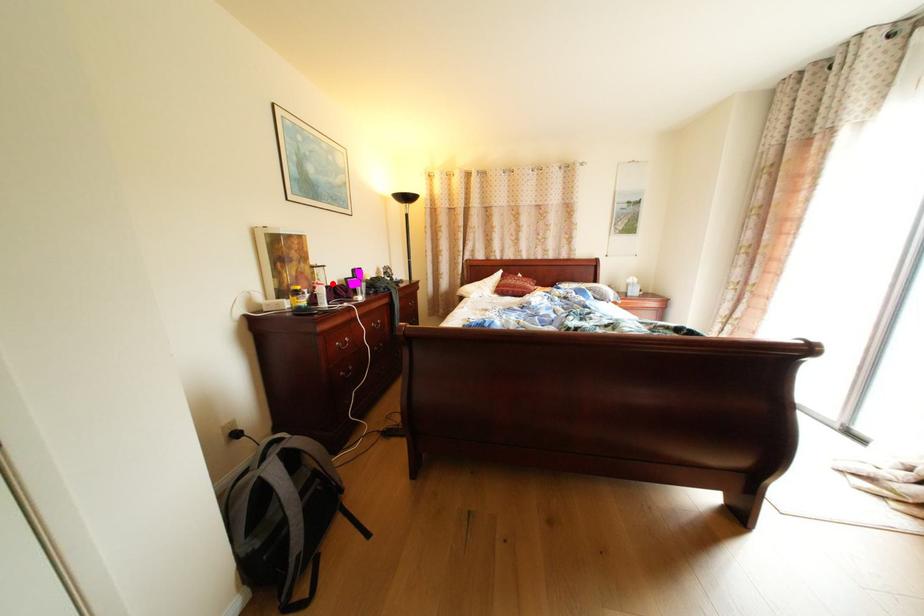
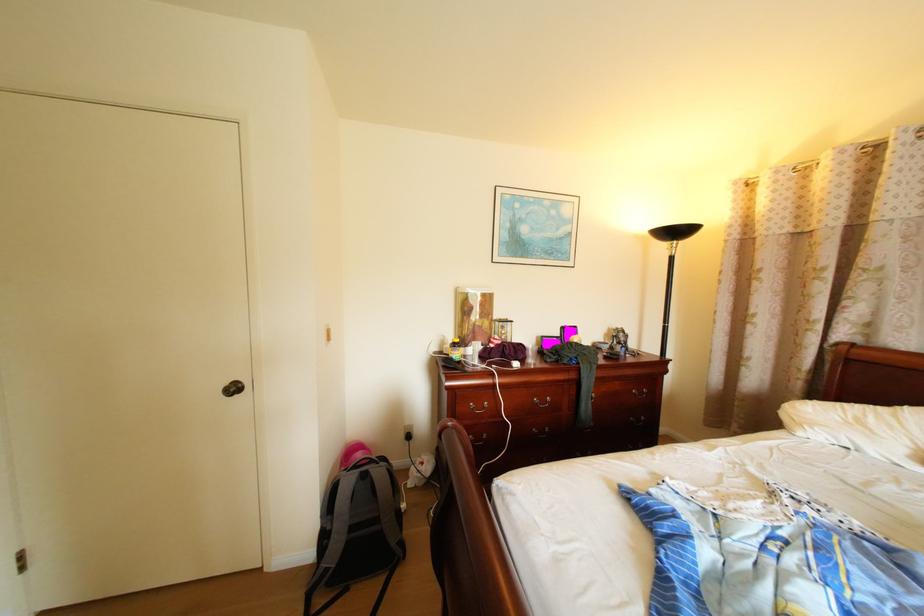
Question: A red point is marked in image1. In image2, is the corresponding 3D point closer to the camera or farther? Reply with the corresponding letter.

Choices:
 (A) The corresponding 3D point is closer.
 (B) The corresponding 3D point is farther.

Answer: (B)